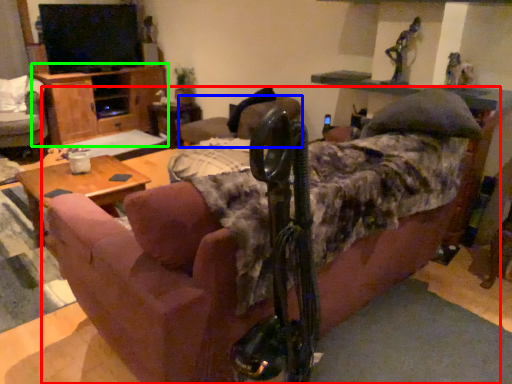
Question: Which is farther away from studio couch (highlighted by a red box)? chair (highlighted by a blue box) or dresser (highlighted by a green box)?

Choices:
 (A) chair
 (B) dresser

Answer: (B)